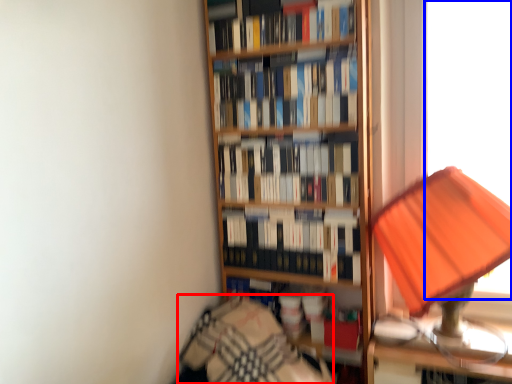
Question: Which of the following is the farthest to the observer, bedding (highlighted by a red box) or window screen (highlighted by a blue box)?

Choices:
 (A) bedding
 (B) window screen

Answer: (B)